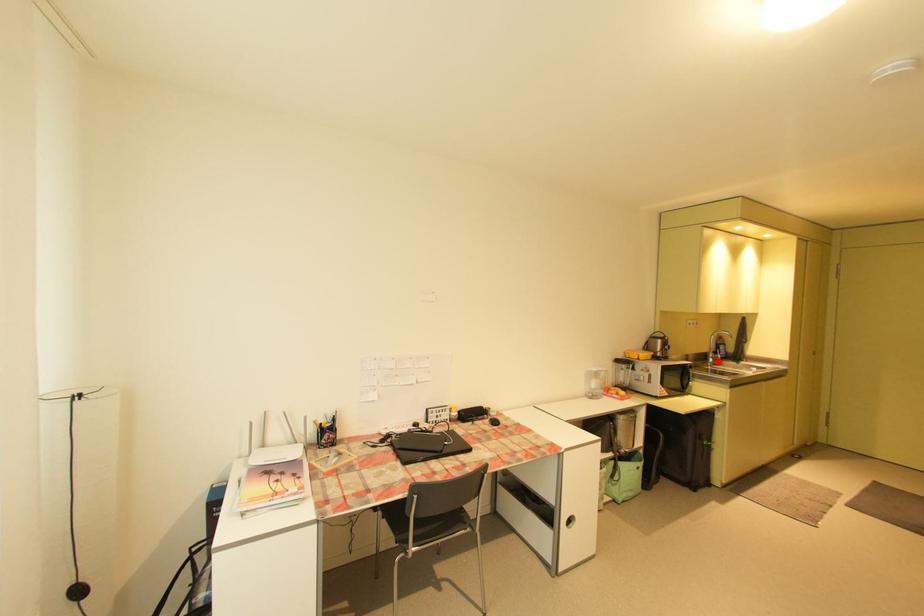
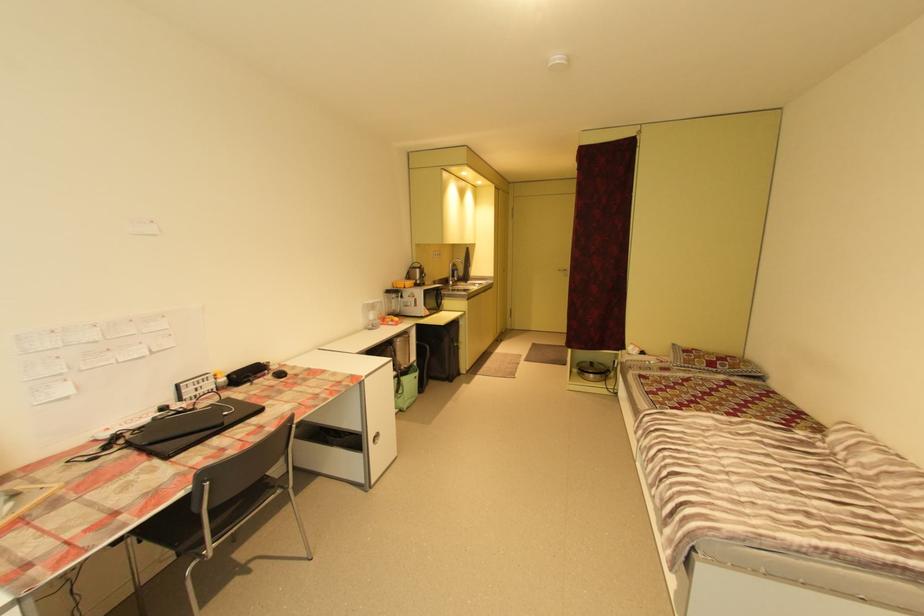
In the second image, find the point that corresponds to the highlighted location in the first image.

(457, 284)